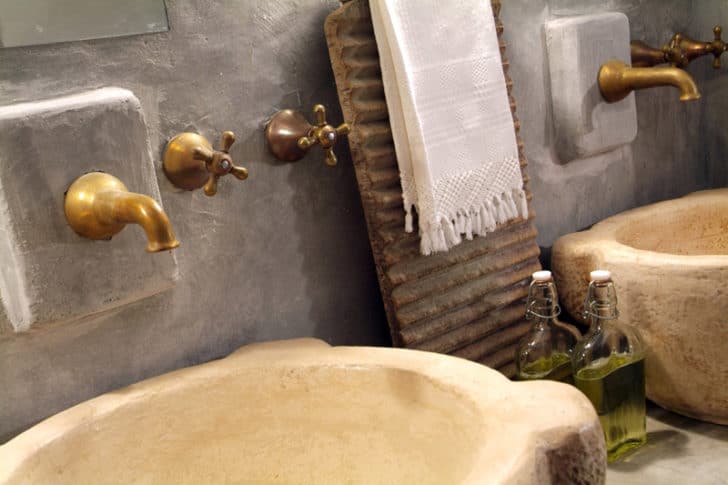
In order to click on countertop in this screenshot , I will do `click(670, 461)`.